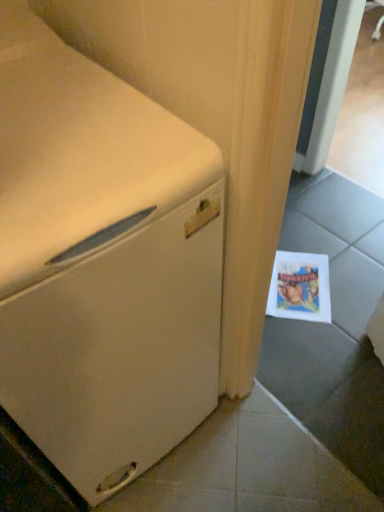
Question: Visually, is white matte refrigerator at left positioned to the left or to the right of matte paper postcard at lower right?

Choices:
 (A) right
 (B) left

Answer: (B)

Question: Is white matte refrigerator at left inside or outside of matte paper postcard at lower right?

Choices:
 (A) outside
 (B) inside

Answer: (A)

Question: From a real-world perspective, relative to matte paper postcard at lower right, is white matte refrigerator at left vertically above or below?

Choices:
 (A) above
 (B) below

Answer: (A)

Question: In the image, is matte paper postcard at lower right positioned in front of or behind white matte refrigerator at left?

Choices:
 (A) behind
 (B) front

Answer: (A)

Question: From the image's perspective, relative to white matte refrigerator at left, is matte paper postcard at lower right above or below?

Choices:
 (A) below
 (B) above

Answer: (A)

Question: From their relative heights in the image, would you say matte paper postcard at lower right is taller or shorter than white matte refrigerator at left?

Choices:
 (A) short
 (B) tall

Answer: (A)

Question: Is matte paper postcard at lower right bigger or smaller than white matte refrigerator at left?

Choices:
 (A) big
 (B) small

Answer: (B)